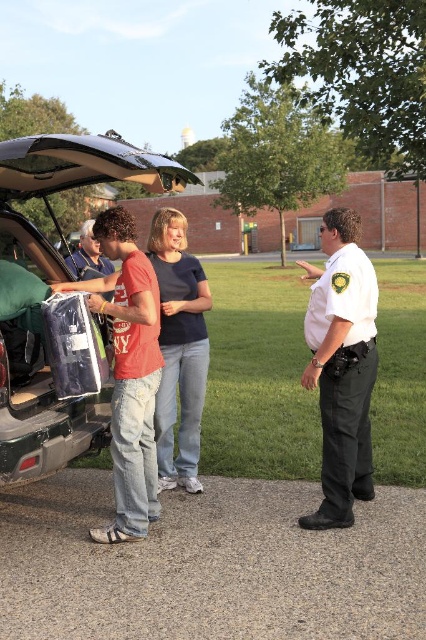
Question: Among these points, which one is nearest to the camera?

Choices:
 (A) (166, 220)
 (B) (363, 396)
 (C) (83, 328)

Answer: (C)

Question: Which point is farther to the camera?

Choices:
 (A) metallic silver car at center
 (B) white uniform at right

Answer: (A)

Question: Which of the following is the closest to the observer?

Choices:
 (A) (160, 220)
 (B) (359, 493)
 (C) (49, 132)

Answer: (B)

Question: Can you confirm if metallic silver car at center is thinner than blue cotton shirt at center?

Choices:
 (A) no
 (B) yes

Answer: (B)

Question: Is white uniform at right wider than blue cotton shirt at center?

Choices:
 (A) yes
 (B) no

Answer: (A)

Question: Can you confirm if metallic silver car at center is positioned to the left of blue cotton shirt at center?

Choices:
 (A) yes
 (B) no

Answer: (A)